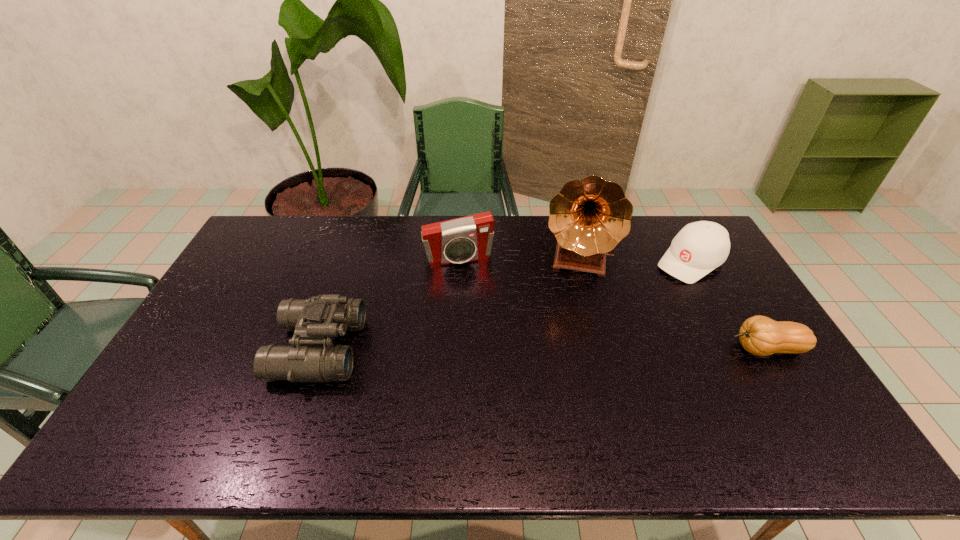
Locate an element on the screen. The height and width of the screenshot is (540, 960). the second closest object relative to the leftmost object is located at coordinates (589, 217).

Where is `vacant point that satisfies the following two spatial constraints: 1. on the front side of the gourd; 2. on the stem side of the camera`? This screenshot has height=540, width=960. vacant point that satisfies the following two spatial constraints: 1. on the front side of the gourd; 2. on the stem side of the camera is located at coordinates (453, 349).